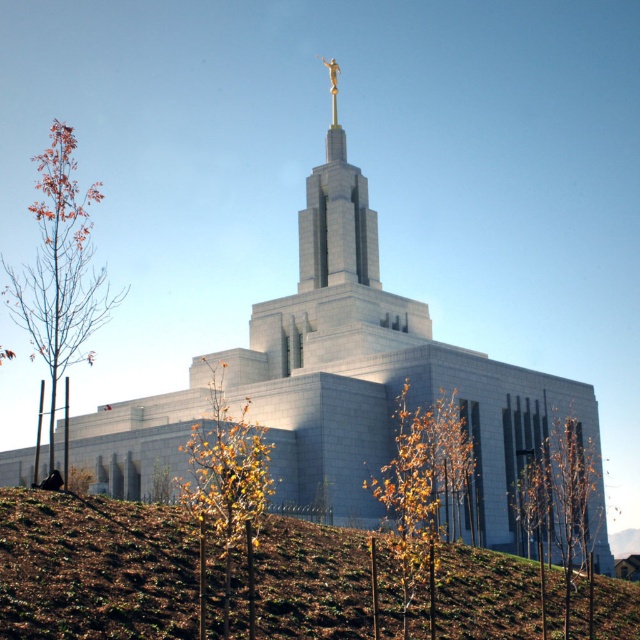
Question: Is brown soil at lower left smaller than yellow-green foliage at center?

Choices:
 (A) yes
 (B) no

Answer: (A)

Question: Can you confirm if yellow-green foliage at center is positioned to the right of yellow-green leaves at lower center?

Choices:
 (A) no
 (B) yes

Answer: (B)

Question: Which of the following is the closest to the observer?

Choices:
 (A) (458, 584)
 (B) (396, 545)

Answer: (B)

Question: Which of the following is the farthest from the observer?

Choices:
 (A) (99, 316)
 (B) (252, 566)
 (C) (436, 568)

Answer: (A)

Question: Which point appears farthest from the camera in this image?

Choices:
 (A) (20, 627)
 (B) (404, 474)
 (C) (532, 513)

Answer: (C)

Question: Can you confirm if brown soil at lower left is positioned above yellow-green leaves at lower center?

Choices:
 (A) yes
 (B) no

Answer: (B)